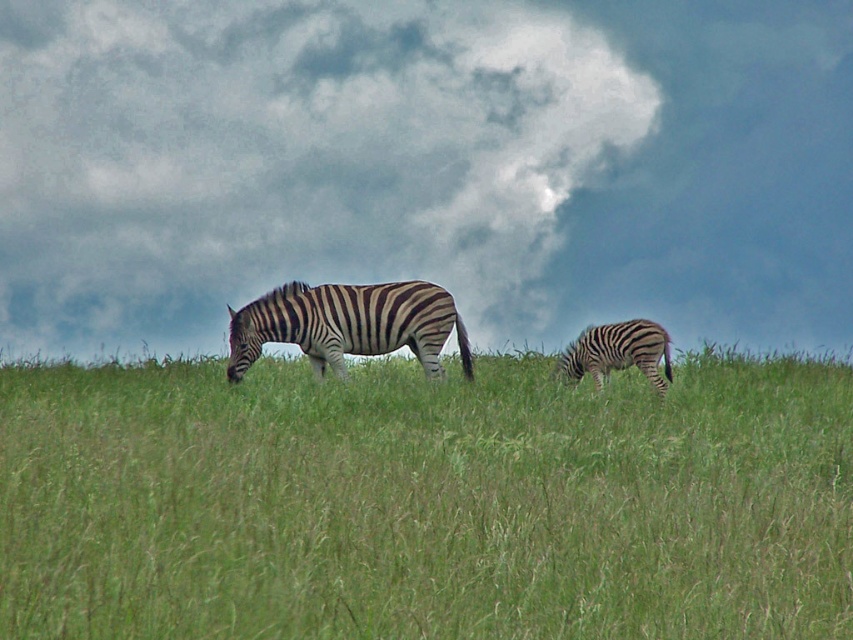
Can you confirm if cloudy sky at upper center is shorter than black and white striped zebra at center?

Indeed, cloudy sky at upper center has a lesser height compared to black and white striped zebra at center.

Who is more forward, (56, 228) or (242, 308)?

Point (242, 308)

Who is more forward, (x=440, y=260) or (x=347, y=305)?

Positioned in front is point (x=347, y=305).

Where is `cloudy sky at upper center`? This screenshot has width=853, height=640. cloudy sky at upper center is located at coordinates (289, 156).

Between point (640, 481) and point (61, 246), which one is positioned behind?

The point (61, 246) is more distant.

Is green grass at center thinner than cloudy sky at upper center?

Incorrect, green grass at center's width is not less than cloudy sky at upper center's.

Who is more forward, [500,572] or [465,125]?

Point [500,572]

The image size is (853, 640). In order to click on green grass at center in this screenshot , I will do `click(425, 502)`.

Is green grass at center taller than black and white striped zebra at lower right?

Correct, green grass at center is much taller as black and white striped zebra at lower right.

Who is more forward, (247, 593) or (593, 342)?

Point (247, 593) is in front.

Based on the photo, measure the distance between green grass at center and camera.

green grass at center is 5.67 meters from camera.

You are a GUI agent. You are given a task and a screenshot of the screen. Output one action in this format:
    pyautogui.click(x=<x>, y=<y>)
    Task: Click on the green grass at center
    
    Given the screenshot: What is the action you would take?
    pyautogui.click(x=425, y=502)